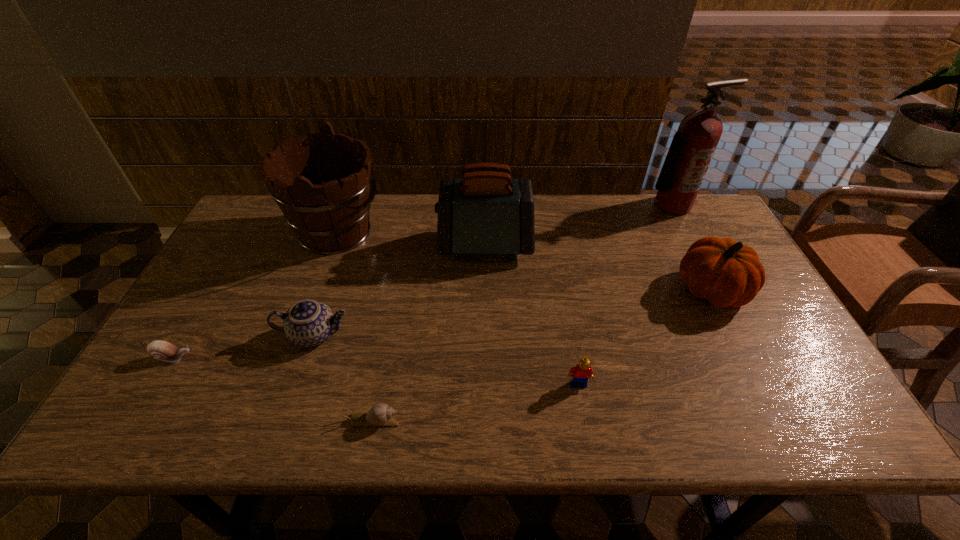
I want to click on the tallest object, so click(x=692, y=148).

What are the coordinates of `wine bucket` in the screenshot? It's located at (332, 217).

Find the location of a particular element. This screenshot has height=540, width=960. toaster is located at coordinates (486, 212).

In order to click on pumpkin in this screenshot , I will do 726,273.

Identify the location of the fourth shortest object. The image size is (960, 540). (307, 323).

The image size is (960, 540). I want to click on Lego, so [582, 371].

Identify the location of the sixth tallest object. The width and height of the screenshot is (960, 540). (582, 371).

Locate an element on the screen. The image size is (960, 540). the left escargot is located at coordinates (162, 350).

This screenshot has height=540, width=960. What are the coordinates of `the leftmost object` in the screenshot? It's located at (162, 350).

Where is `the nearer escargot`? the nearer escargot is located at coordinates (380, 414).